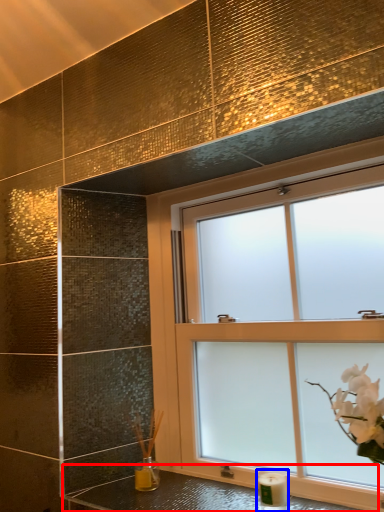
Question: Which object is closer to the camera taking this photo, counter top (highlighted by a red box) or candle holder (highlighted by a blue box)?

Choices:
 (A) counter top
 (B) candle holder

Answer: (A)